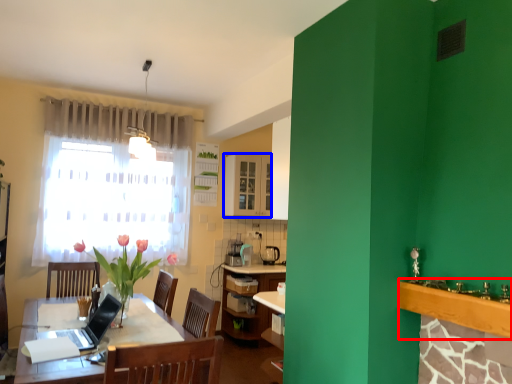
Question: Which object is closer to the camera taking this photo, counter top (highlighted by a red box) or cabinetry (highlighted by a blue box)?

Choices:
 (A) counter top
 (B) cabinetry

Answer: (A)